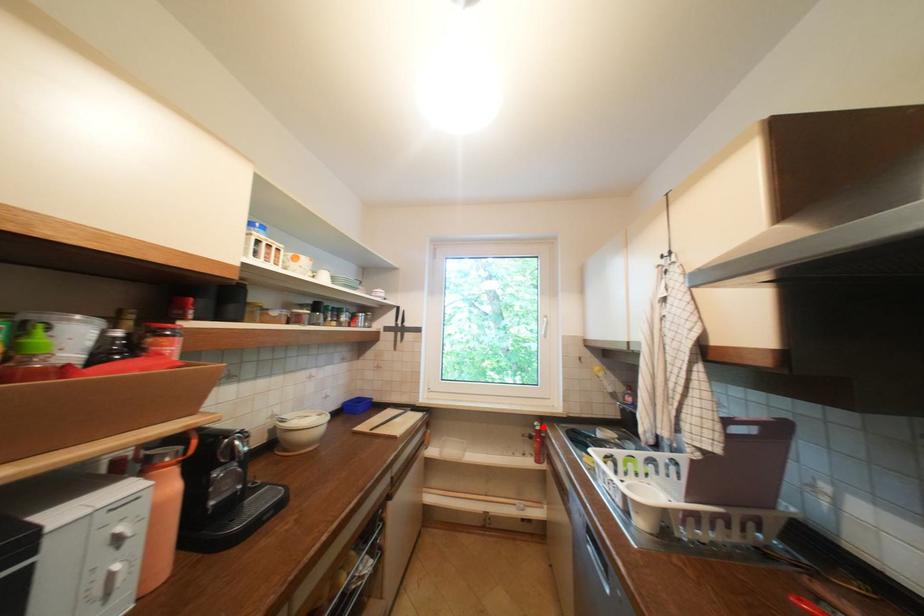
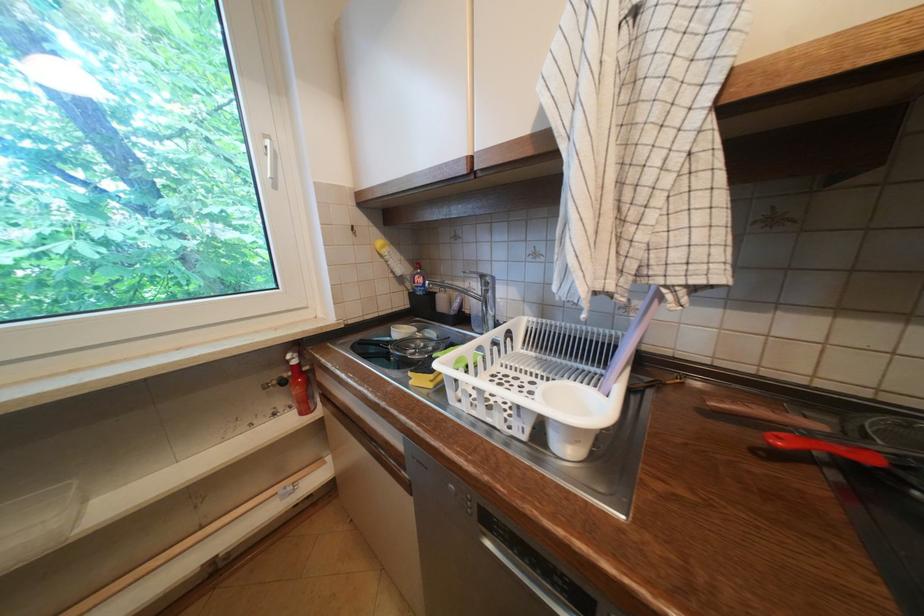
In the second image, find the point that corresponds to the highlighted location in the first image.

(296, 362)